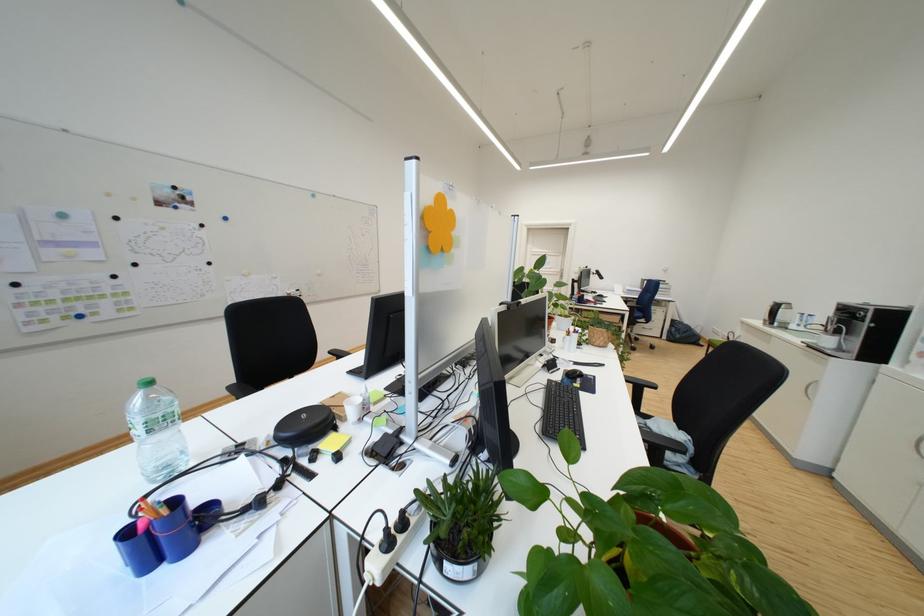
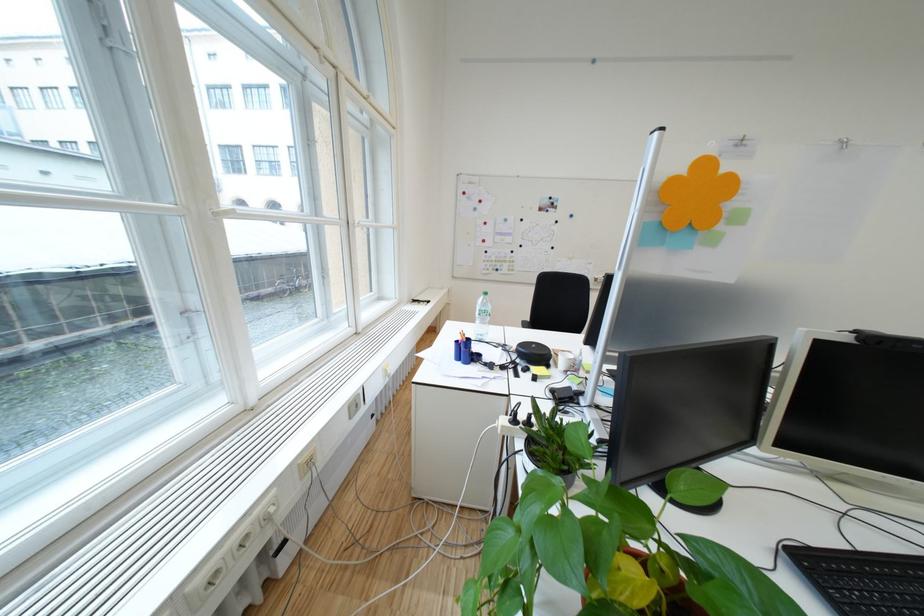
Locate, in the second image, the point that corresponds to (x=163, y=561) in the first image.

(470, 359)